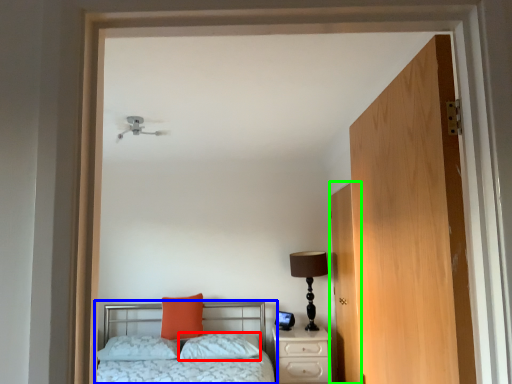
Question: Considering the real-world distances, which object is farthest from pillow (highlighted by a red box)? bed (highlighted by a blue box) or door (highlighted by a green box)?

Choices:
 (A) bed
 (B) door

Answer: (B)